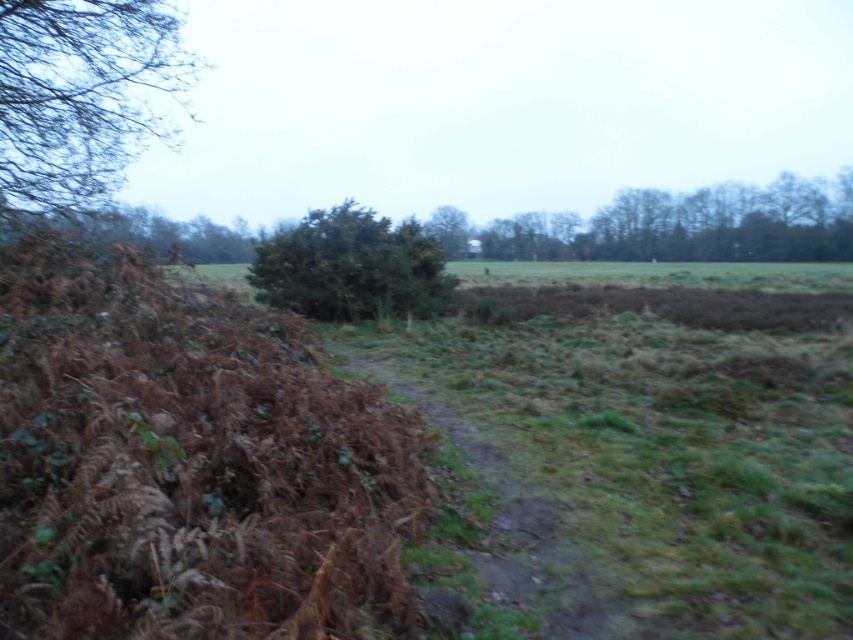
You are standing at the brown textured bush at upper left and want to walk to the nearest tree. The nearest tree is 10 meters away from you. Can you reach the tree without walking more than 10 meters?

The brown textured bush at upper left and viewer are 9.96 meters apart from each other. Since the nearest tree is 10 meters away, you can reach the tree without walking more than 10 meters because 9.96 meters is less than 10 meters.

You are standing at the point with coordinates point (457, 433) and want to walk towards the horizon. There is an obstacle at point (3, 129). Will you be able to see the obstacle from your current position?

Point (3, 129) is behind point (457, 433), so you will not be able to see the obstacle at point (3, 129) from your current position at point (457, 433) because it is located behind you.